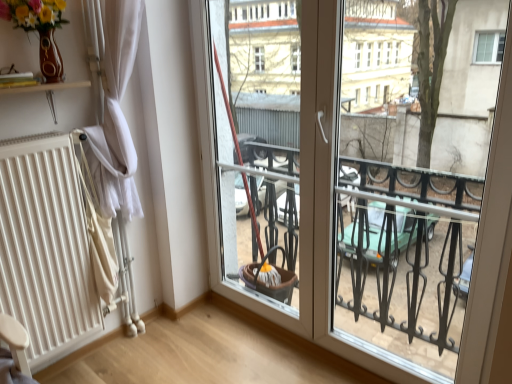
Question: Is white matte radiator at left oriented away from matte brown vase at upper left?

Choices:
 (A) yes
 (B) no

Answer: (B)

Question: Does white matte radiator at left touch matte brown vase at upper left?

Choices:
 (A) no
 (B) yes

Answer: (A)

Question: From the image's perspective, is white matte radiator at left on top of matte brown vase at upper left?

Choices:
 (A) no
 (B) yes

Answer: (A)

Question: Can you confirm if white matte radiator at left is taller than matte brown vase at upper left?

Choices:
 (A) no
 (B) yes

Answer: (B)

Question: From a real-world perspective, is white matte radiator at left under matte brown vase at upper left?

Choices:
 (A) no
 (B) yes

Answer: (B)

Question: Would you say matte brown vase at upper left is part of white matte radiator at left's contents?

Choices:
 (A) no
 (B) yes

Answer: (A)

Question: Would you say matte brown vase at upper left contains white matte radiator at left?

Choices:
 (A) yes
 (B) no

Answer: (B)

Question: Is white matte radiator at left at the back of matte brown vase at upper left?

Choices:
 (A) no
 (B) yes

Answer: (A)

Question: Does matte brown vase at upper left appear on the left side of white matte radiator at left?

Choices:
 (A) no
 (B) yes

Answer: (A)

Question: Is the position of matte brown vase at upper left more distant than that of white matte radiator at left?

Choices:
 (A) yes
 (B) no

Answer: (B)

Question: From the image's perspective, is matte brown vase at upper left located above white matte radiator at left?

Choices:
 (A) yes
 (B) no

Answer: (A)

Question: Considering the relative sizes of matte brown vase at upper left and white matte radiator at left in the image provided, is matte brown vase at upper left bigger than white matte radiator at left?

Choices:
 (A) yes
 (B) no

Answer: (B)

Question: From a real-world perspective, is white fabric curtain at left beneath white matte radiator at left?

Choices:
 (A) yes
 (B) no

Answer: (B)